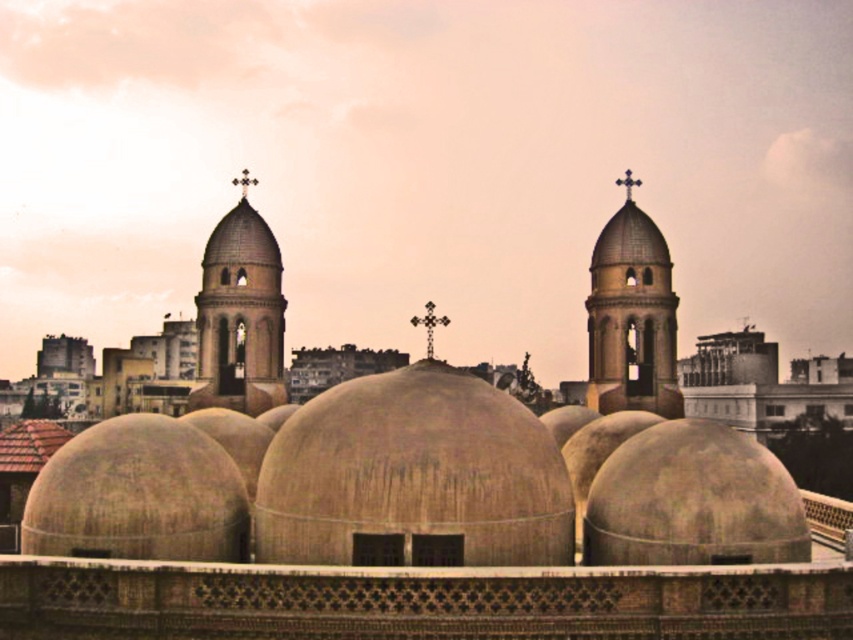
You are standing in front of the architectural complex and want to determine the relative positions of two points marked on the structure. Which point is closer to you, point 1 at coordinates (653, 300) or point 2 at coordinates (701, 424)?

Point 1 at coordinates (653, 300) is closer to you because it is further to the viewer than point 2 at coordinates (701, 424).

You are standing in front of the architectural complex and want to take a photo of both the beige concrete domes at center and the matte concrete dome at center. Which dome should you focus on first to ensure it appears larger in your photo?

The beige concrete domes at center is closer to the viewer than the matte concrete dome at center, so focusing on the beige concrete domes at center first will make it appear larger in the photo.